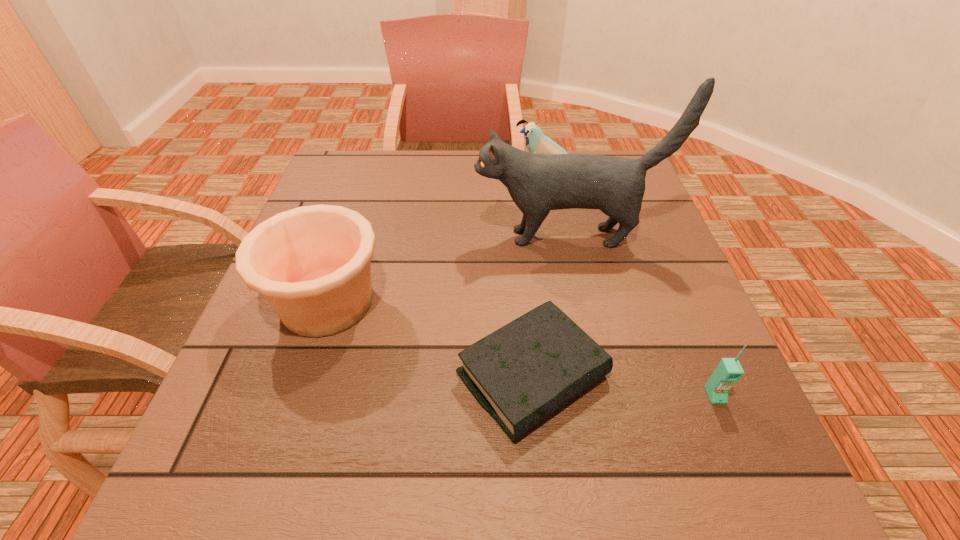
Locate an element on the screen. Image resolution: width=960 pixels, height=540 pixels. vacant area between the second shortest object and the bird is located at coordinates (634, 285).

Identify the location of free point between the farthest object and the cellular telephone. (634, 285).

You are a GUI agent. You are given a task and a screenshot of the screen. Output one action in this format:
    pyautogui.click(x=<x>, y=<y>)
    Task: Click on the free spot between the cellular telephone and the tallest object
    The width and height of the screenshot is (960, 540).
    Given the screenshot: What is the action you would take?
    pyautogui.click(x=641, y=316)

Locate an element on the screen. free space between the pottery and the Bible is located at coordinates (429, 339).

Identify the location of free point between the pottery and the tallest object. The height and width of the screenshot is (540, 960). (447, 269).

Where is `the fourth closest object to the Bible`? This screenshot has width=960, height=540. the fourth closest object to the Bible is located at coordinates (536, 142).

Where is `object that is the third closest to the shortest object`? This screenshot has width=960, height=540. object that is the third closest to the shortest object is located at coordinates (537, 183).

You are a GUI agent. You are given a task and a screenshot of the screen. Output one action in this format:
    pyautogui.click(x=<x>, y=<y>)
    Task: Click on the blank area in the image that satisfies the following two spatial constraints: 1. at the face of the second farthest object; 2. on the front side of the leftmost object
    The width and height of the screenshot is (960, 540).
    Given the screenshot: What is the action you would take?
    click(582, 302)

Find the location of a particular element. The image size is (960, 540). vacant region that satisfies the following two spatial constraints: 1. at the face of the bird; 2. on the front side of the pottery is located at coordinates (579, 302).